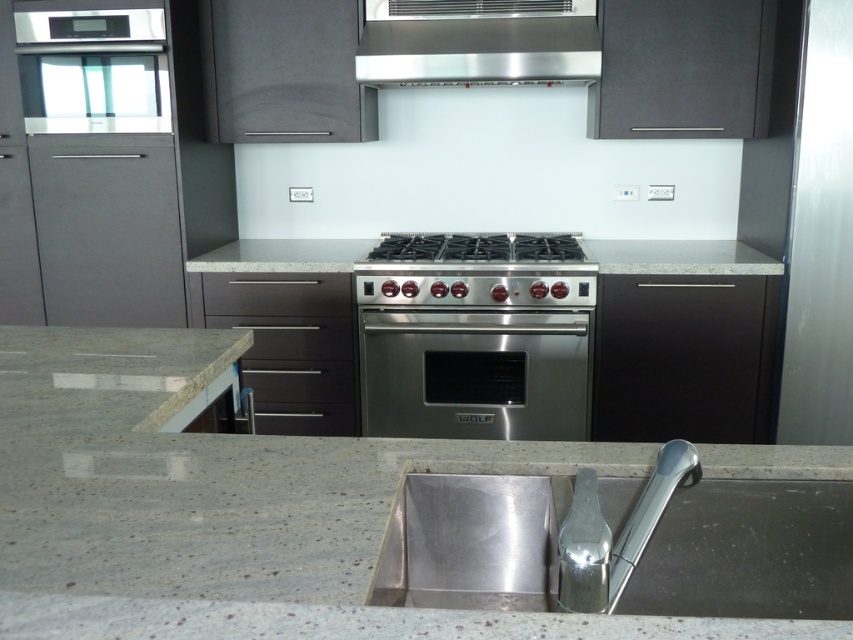
Does granite countertop at center appear on the left side of satin nickel faucet at lower center?

Yes, granite countertop at center is to the left of satin nickel faucet at lower center.

Is granite countertop at center in front of satin nickel faucet at lower center?

Yes.

Image resolution: width=853 pixels, height=640 pixels. I want to click on granite countertop at center, so click(233, 508).

Is stainless steel oven at center to the left of stainless steel exhaust hood at upper center from the viewer's perspective?

Yes, stainless steel oven at center is to the left of stainless steel exhaust hood at upper center.

Between stainless steel oven at center and stainless steel exhaust hood at upper center, which one appears on the right side from the viewer's perspective?

stainless steel exhaust hood at upper center is more to the right.

What do you see at coordinates (474, 372) in the screenshot? This screenshot has height=640, width=853. I see `stainless steel oven at center` at bounding box center [474, 372].

Identify the location of stainless steel oven at center. This screenshot has height=640, width=853. (474, 372).

Is stainless steel oven at center to the left of satin nickel faucet at lower center from the viewer's perspective?

Indeed, stainless steel oven at center is positioned on the left side of satin nickel faucet at lower center.

Find the location of `stainless steel oven at center`. stainless steel oven at center is located at coordinates (474, 372).

This screenshot has height=640, width=853. What do you see at coordinates (474, 372) in the screenshot? I see `stainless steel oven at center` at bounding box center [474, 372].

The width and height of the screenshot is (853, 640). Find the location of `stainless steel oven at center`. stainless steel oven at center is located at coordinates (474, 372).